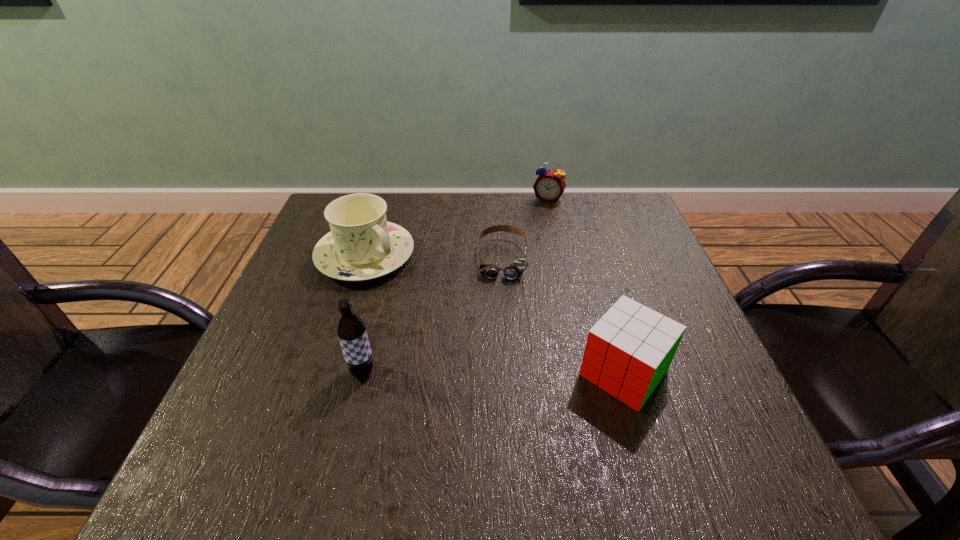
Find the location of a particular element. blank space located 0.230m on the front-facing side of the shortest object is located at coordinates (499, 360).

Locate an element on the screen. vacant space situated 0.130m on the front-facing side of the farthest object is located at coordinates (533, 230).

Identify the location of free space located on the front-facing side of the farthest object. (537, 222).

I want to click on free point located 0.230m on the front-facing side of the farthest object, so click(523, 252).

Image resolution: width=960 pixels, height=540 pixels. In order to click on free space located 0.090m on the handle side of the chinaware in this screenshot , I will do `click(420, 297)`.

Locate an element on the screen. Image resolution: width=960 pixels, height=540 pixels. free space located on the handle side of the chinaware is located at coordinates (516, 368).

Where is `vacant position located on the handle side of the chinaware`? vacant position located on the handle side of the chinaware is located at coordinates (429, 303).

I want to click on goggles present at the far edge, so click(x=515, y=269).

At what (x,y) coordinates should I click in order to perform the action: click on alarm clock that is positioned at the far edge. Please return your answer as a coordinate pair (x, y). Looking at the image, I should click on (549, 186).

Find the location of a particular element. Image resolution: width=960 pixels, height=540 pixels. chinaware that is at the far edge is located at coordinates (362, 245).